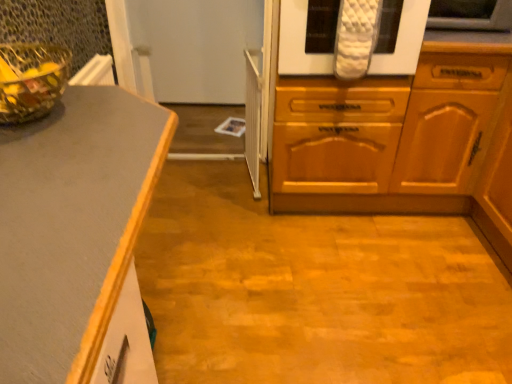
Question: In terms of height, does white quilted oven mitts at upper center look taller or shorter compared to wooden cabinet at center?

Choices:
 (A) short
 (B) tall

Answer: (A)

Question: Considering the positions of point (285, 72) and point (313, 196), is point (285, 72) closer or farther from the camera than point (313, 196)?

Choices:
 (A) farther
 (B) closer

Answer: (B)

Question: Estimate the real-world distances between objects in this image. Which object is farther from the wooden cabinet at center?

Choices:
 (A) white quilted oven mitt at upper right
 (B) transparent glass bowl at upper left
 (C) white quilted oven mitts at upper center

Answer: (B)

Question: Estimate the real-world distances between objects in this image. Which object is closer to the transparent glass bowl at upper left?

Choices:
 (A) wooden cabinet at center
 (B) white quilted oven mitt at upper right
 (C) white quilted oven mitts at upper center

Answer: (C)